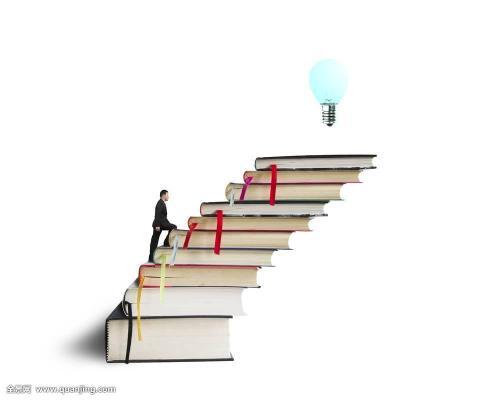
Find the location of a particular element. books stacked in the shape of a staircase is located at coordinates (181, 326), (194, 297), (214, 274), (246, 254), (242, 235), (255, 222), (261, 208), (298, 189), (306, 176), (318, 160).